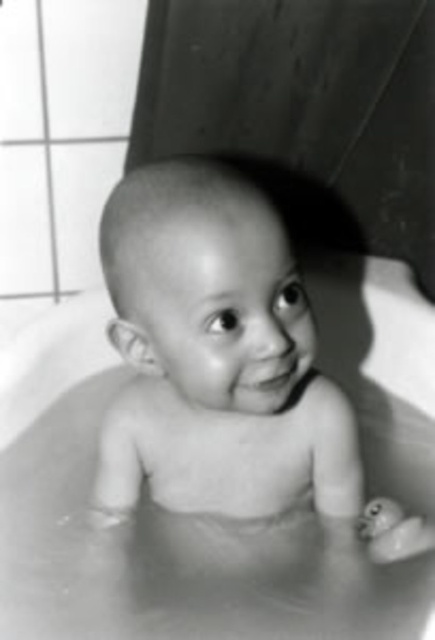
You are a photographer trying to capture the baby in the bathtub. You need to position your camera at a specific point to get the best shot. The coordinates given are point (x=143, y=525). Based on the scene description, what object is located at this coordinate?

The point (x=143, y=525) corresponds to the smooth rubber bath at center.

You are taking a photo of a baby in a bathtub. You notice two points in the image at coordinates point (414, 426) and point (114, 467). Which point is closer to the camera?

Point (414, 426) is further to the camera than point (114, 467), so the closer point to the camera is point (114, 467).

You are a parent trying to place a small rubber duck toy between the smooth rubber bath at center and the smooth skin baby at center in the bathtub. The duck is 20 centimeters long. Can the duck fit entirely between them without overlapping either object?

The smooth rubber bath at center and smooth skin baby at center are 23.40 centimeters apart. Since the duck is 20 centimeters long, it can fit between them without overlapping as 20 cm is less than 23.40 cm.